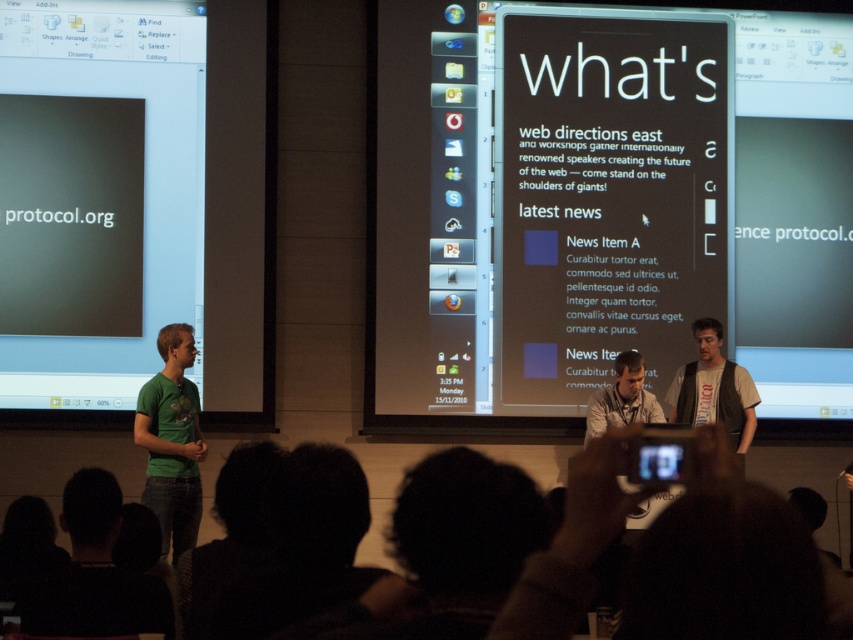
You are a photographer in the audience at this presentation. You want to capture a clear photo of both point (180, 493) and point (737, 436) on the screens. Considering their positions, which point will appear larger in your photo?

Point (180, 493) is closer to the camera than point (737, 436), so it will appear larger in the photo.